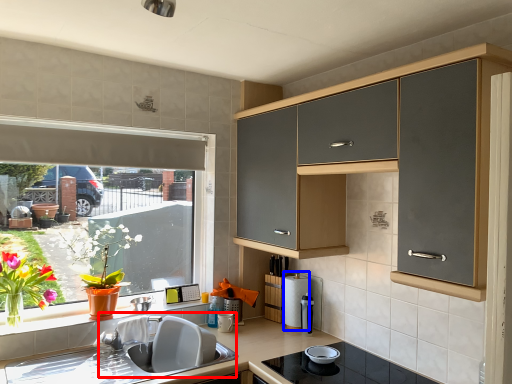
Question: Which point is further to the camera, sink (highlighted by a red box) or appliance (highlighted by a blue box)?

Choices:
 (A) sink
 (B) appliance

Answer: (B)